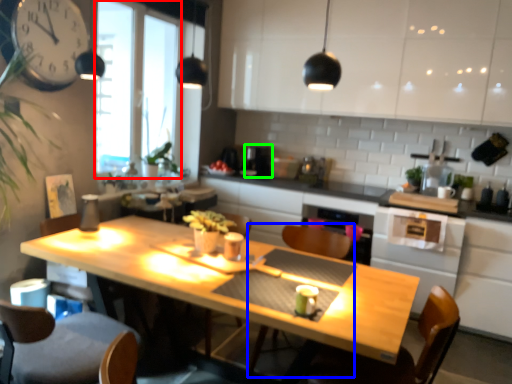
Question: Which object is the closest to the window screen (highlighted by a red box)? Choose among these: armchair (highlighted by a blue box) or coffee machine (highlighted by a green box).

Choices:
 (A) armchair
 (B) coffee machine

Answer: (B)